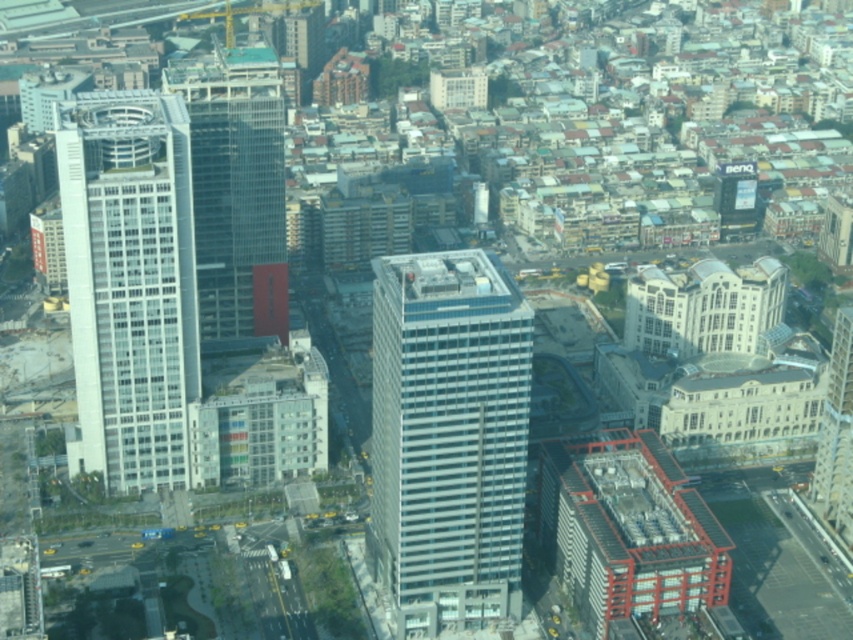
Does white glass building at left have a greater width compared to glassy steel skyscraper at center?

Yes.

Is white glass building at left positioned at the back of glassy steel skyscraper at center?

No, white glass building at left is closer to the viewer.

Between point (119, 118) and point (813, 500), which one is positioned behind?

The point (813, 500) is behind.

This screenshot has width=853, height=640. Find the location of `white glass building at left`. white glass building at left is located at coordinates (131, 282).

I want to click on glassy white skyscraper at center, so click(x=448, y=435).

Can you confirm if glassy white skyscraper at center is bigger than white glass building at left?

Correct, glassy white skyscraper at center is larger in size than white glass building at left.

Find the location of `glassy white skyscraper at center`. glassy white skyscraper at center is located at coordinates (448, 435).

I want to click on glassy white skyscraper at center, so click(x=448, y=435).

Does glassy white skyscraper at center appear on the right side of glassy steel skyscraper at center?

In fact, glassy white skyscraper at center is to the left of glassy steel skyscraper at center.

Which is in front, point (508, 381) or point (838, 388)?

Point (508, 381)

I want to click on glassy white skyscraper at center, so click(448, 435).